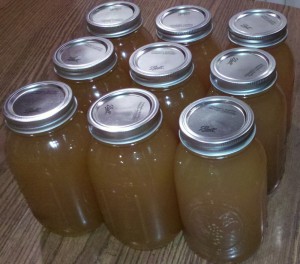
Locate an element on the screen. jar is located at coordinates (134, 42), (201, 50), (280, 54), (120, 75), (175, 101), (268, 122), (246, 173), (137, 166), (65, 157).